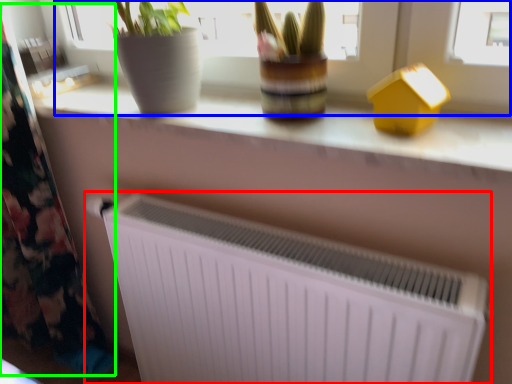
Question: Which is farther away from radiator (highlighted by a red box)? bay window (highlighted by a blue box) or curtain (highlighted by a green box)?

Choices:
 (A) bay window
 (B) curtain

Answer: (B)